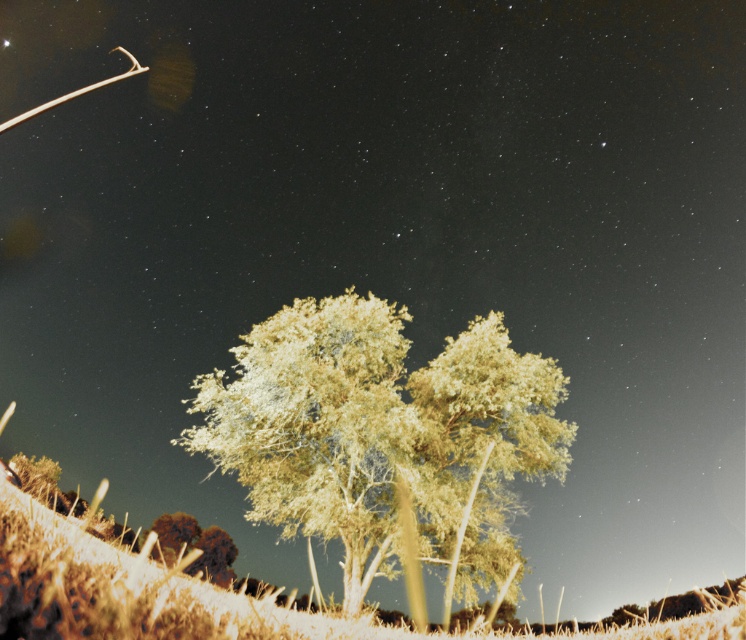
Based on the scene description, where is the green leafy tree at center located in terms of its 2D coordinates?

The green leafy tree at center is located at the 2D coordinates of point (x=383, y=436).

You are standing in the field looking at the green leafy tree at center and the brown fuzzy bush at lower left. Which object is positioned more to the east if the tree is tilted towards the west?

The brown fuzzy bush at lower left is positioned more to the east since the green leafy tree at center is to its right and tilted westward, meaning the tree leans away from the east direction.